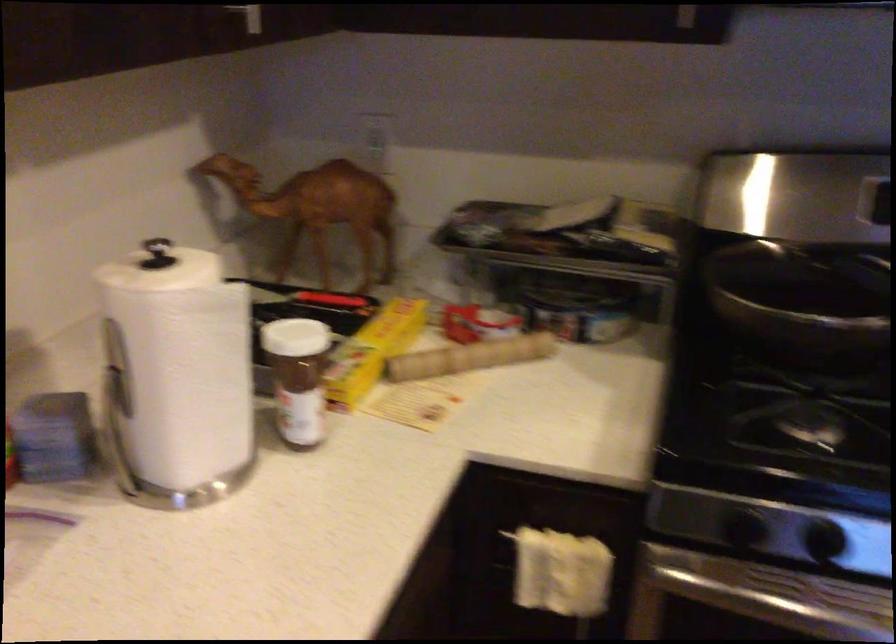
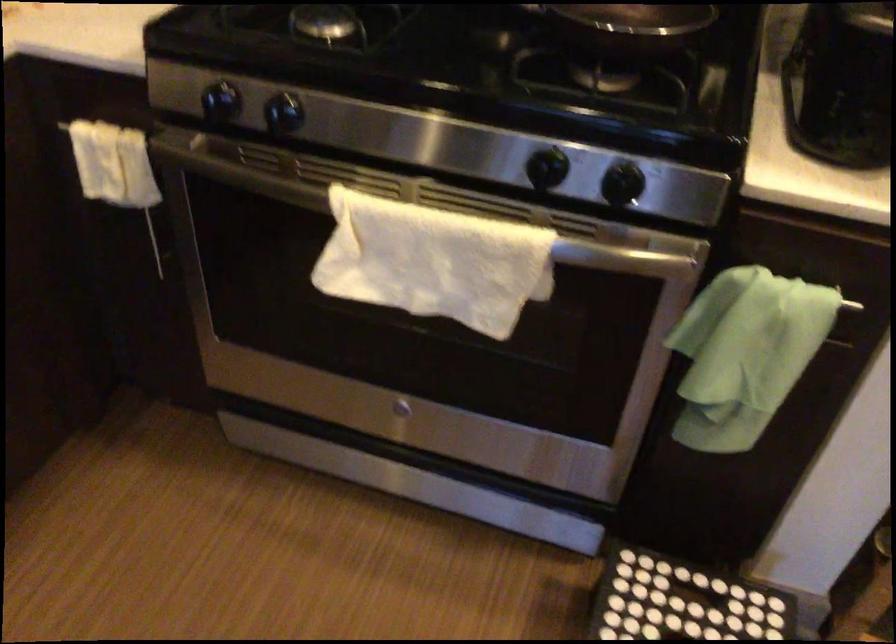
Question: How did the camera likely rotate?

Choices:
 (A) Left
 (B) Right
 (C) Up
 (D) Down

Answer: (D)